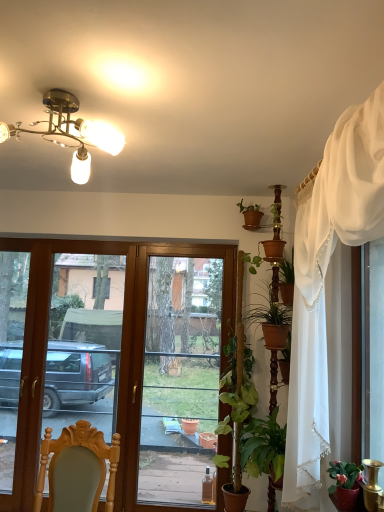
Question: From the image's perspective, is wooden chair at lower left on matte red pot at lower right, which is the 2th houseplant from top to bottom?

Choices:
 (A) yes
 (B) no

Answer: (A)

Question: Does wooden chair at lower left lie behind matte red pot at lower right, placed as the 3th houseplant when sorted from back to front?

Choices:
 (A) yes
 (B) no

Answer: (B)

Question: Is wooden chair at lower left closer to camera compared to matte red pot at lower right, the 2th houseplant in the bottom-to-top sequence?

Choices:
 (A) yes
 (B) no

Answer: (A)

Question: Considering the relative sizes of wooden chair at lower left and matte red pot at lower right, the 2th houseplant in the bottom-to-top sequence, in the image provided, is wooden chair at lower left thinner than matte red pot at lower right, the 2th houseplant in the bottom-to-top sequence,?

Choices:
 (A) yes
 (B) no

Answer: (B)

Question: Would you say matte red pot at lower right, the 2th houseplant in the bottom-to-top sequence, is part of wooden chair at lower left's contents?

Choices:
 (A) yes
 (B) no

Answer: (B)

Question: Does wooden chair at lower left have a greater height compared to matte red pot at lower right, placed as the 3th houseplant when sorted from back to front?

Choices:
 (A) no
 (B) yes

Answer: (B)

Question: Is green matte plant at right, acting as the second houseplant starting from the front, smaller than matte red pot at lower right, which is the 2th houseplant from top to bottom?

Choices:
 (A) yes
 (B) no

Answer: (B)

Question: From a real-world perspective, is green matte plant at right, the first houseplant positioned from the left, on matte red pot at lower right, which is the 3th houseplant from left to right?

Choices:
 (A) yes
 (B) no

Answer: (B)

Question: From the image's perspective, is green matte plant at right, the first houseplant positioned from the left, under matte red pot at lower right, which is the 3th houseplant from left to right?

Choices:
 (A) yes
 (B) no

Answer: (A)

Question: Is green matte plant at right, which is the 1th houseplant from bottom to top, facing away from matte red pot at lower right, which is the 1th houseplant from front to back?

Choices:
 (A) yes
 (B) no

Answer: (B)

Question: Considering the relative sizes of green matte plant at right, acting as the second houseplant starting from the front, and matte red pot at lower right, which is the 1th houseplant from front to back, in the image provided, is green matte plant at right, acting as the second houseplant starting from the front, taller than matte red pot at lower right, which is the 1th houseplant from front to back,?

Choices:
 (A) yes
 (B) no

Answer: (A)

Question: Can you confirm if green matte plant at right, the first houseplant positioned from the left, is shorter than matte red pot at lower right, the 2th houseplant in the bottom-to-top sequence?

Choices:
 (A) no
 (B) yes

Answer: (A)

Question: Is green leafy plant at center-right turned away from matte red pot at lower right, which is the 1th houseplant from front to back?

Choices:
 (A) yes
 (B) no

Answer: (B)